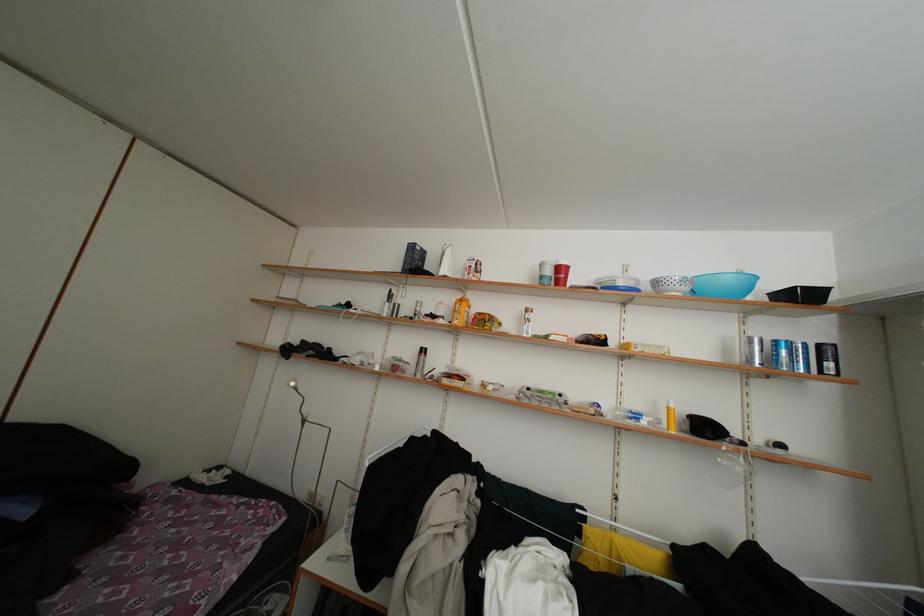
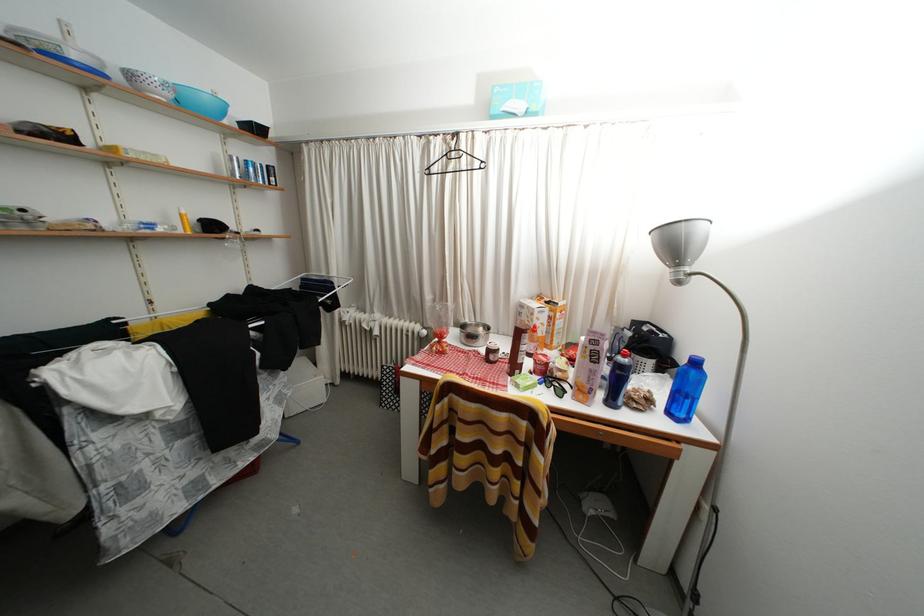
Find the pixel in the second image that matches (x=629, y=288) in the first image.

(81, 61)